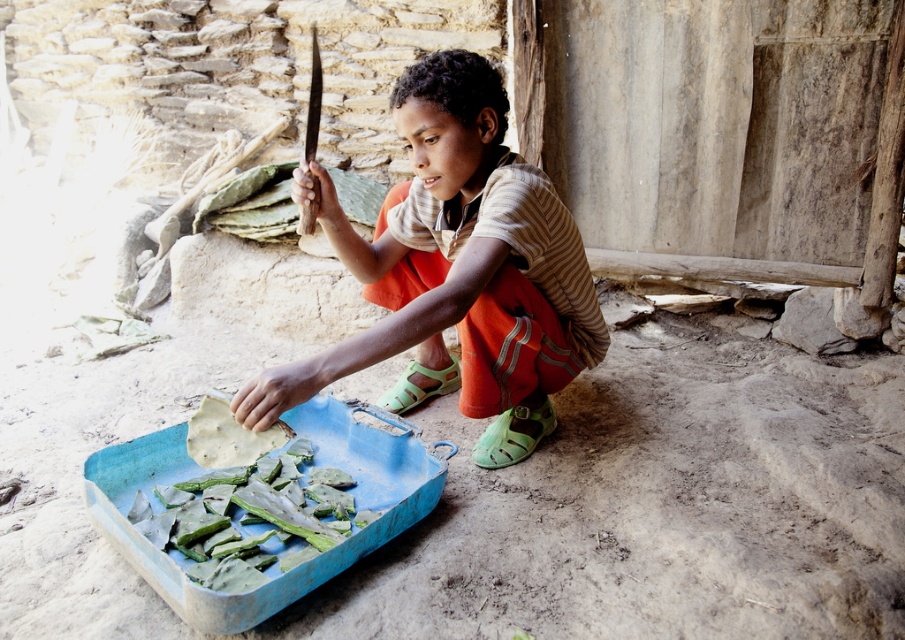
Question: Which of the following is the farthest from the observer?

Choices:
 (A) (510, 364)
 (B) (213, 548)

Answer: (A)

Question: Can you confirm if matte wooden knife at center is positioned above green matte leaves at lower left?

Choices:
 (A) no
 (B) yes

Answer: (B)

Question: Can you confirm if matte wooden knife at center is positioned to the right of green matte leaves at lower left?

Choices:
 (A) yes
 (B) no

Answer: (A)

Question: Which point is farther to the camera?

Choices:
 (A) green matte leaves at lower left
 (B) matte wooden knife at center

Answer: (A)

Question: Does matte wooden knife at center have a greater width compared to green matte leaves at lower left?

Choices:
 (A) no
 (B) yes

Answer: (B)